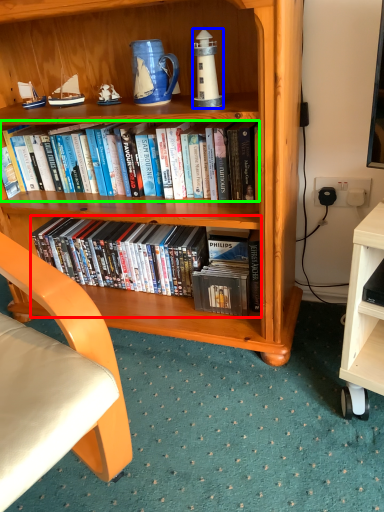
Question: Estimate the real-world distances between objects in this image. Which object is farther from book (highlighted by a red box), lamp (highlighted by a blue box) or book (highlighted by a green box)?

Choices:
 (A) lamp
 (B) book

Answer: (A)